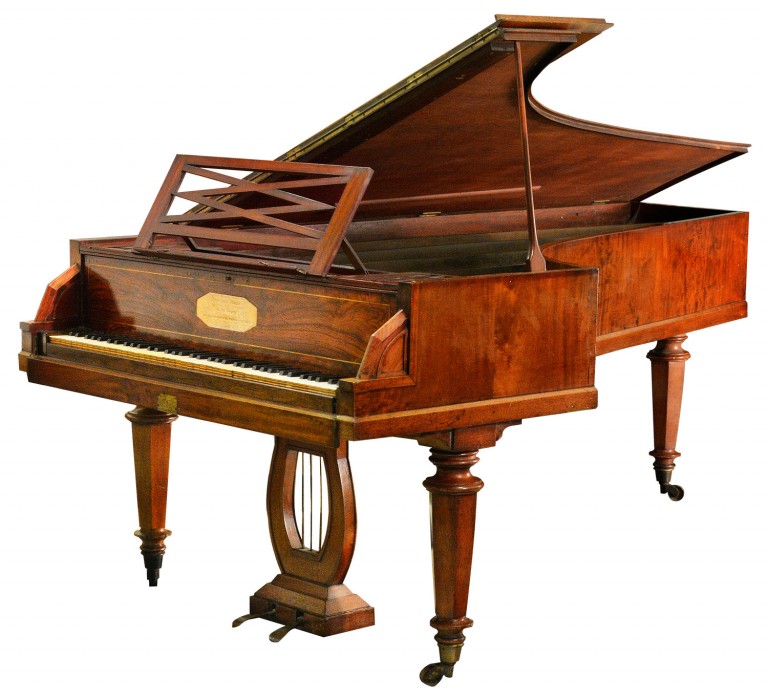
Where is `wood piece holding up lid`? This screenshot has width=768, height=700. wood piece holding up lid is located at coordinates (528, 171).